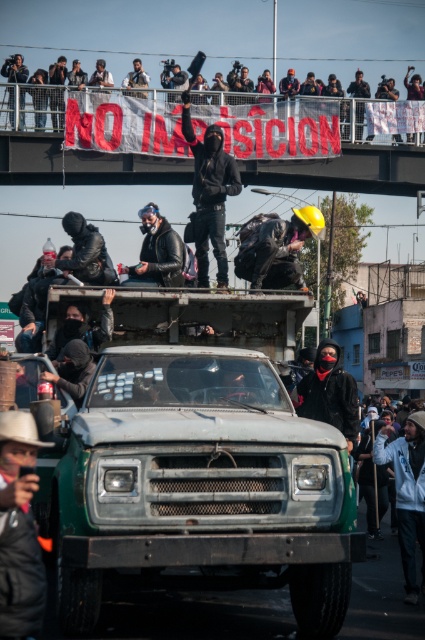
You are a photographer positioned at the front of the protest scene. You need to take a photo that includes both the hard hat at center and the matte black jacket at lower left. Which object should you adjust your camera angle to focus on first to ensure both are in frame?

The hard hat at center is closer to you than the matte black jacket at lower left, so you should focus on the hard hat at center first to ensure both objects are in frame.

You are a photographer trying to capture the protest scene. You want to ensure the black fabric banner at upper center is in the center of your photo. Given its current position at point coordinates, what adjustment should you make to the camera to center it?

The black fabric banner at upper center is already positioned at point coordinates, so no adjustment is needed to center it in the photo.